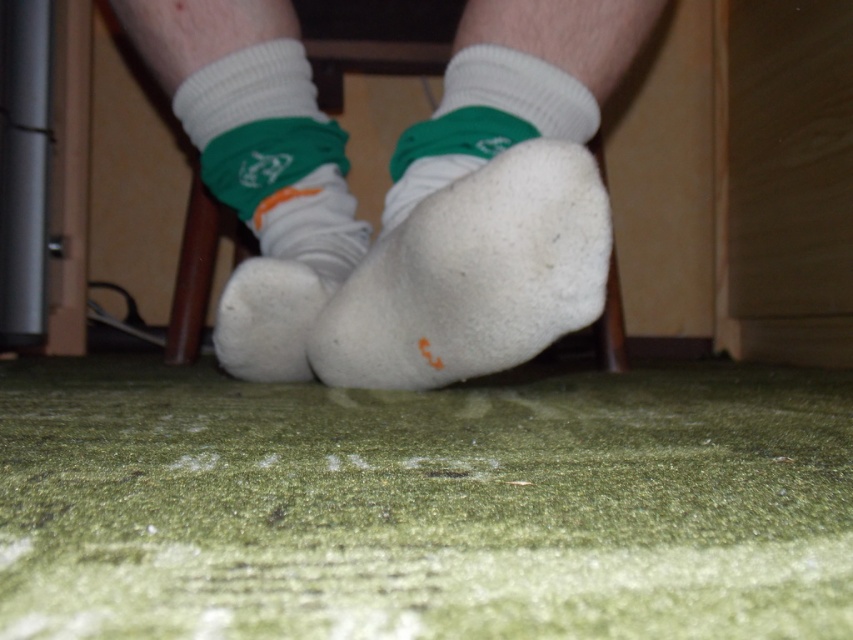
You are a robot trying to locate the white cotton socks at center in a room. According to the coordinates provided, where exactly would you find them?

The white cotton socks at center are located at coordinates point (402, 189).

You are trying to decide which pair of socks to wear today. You see the white cotton socks at center and the white fuzzy sock at lower center. Which one is bigger in size?

The white cotton socks at center has a larger size compared to the white fuzzy sock at lower center, so the white cotton socks at center is bigger in size.

You are arranging two white fuzzy socks on a shelf. The socks are labeled as the white fuzzy sock at center and the white fuzzy sock at lower center. According to the image, which sock should be placed to the left of the other?

The white fuzzy sock at lower center should be placed to the left of the white fuzzy sock at center because the white fuzzy sock at center is positioned on the right side of the white fuzzy sock at lower center in the image.